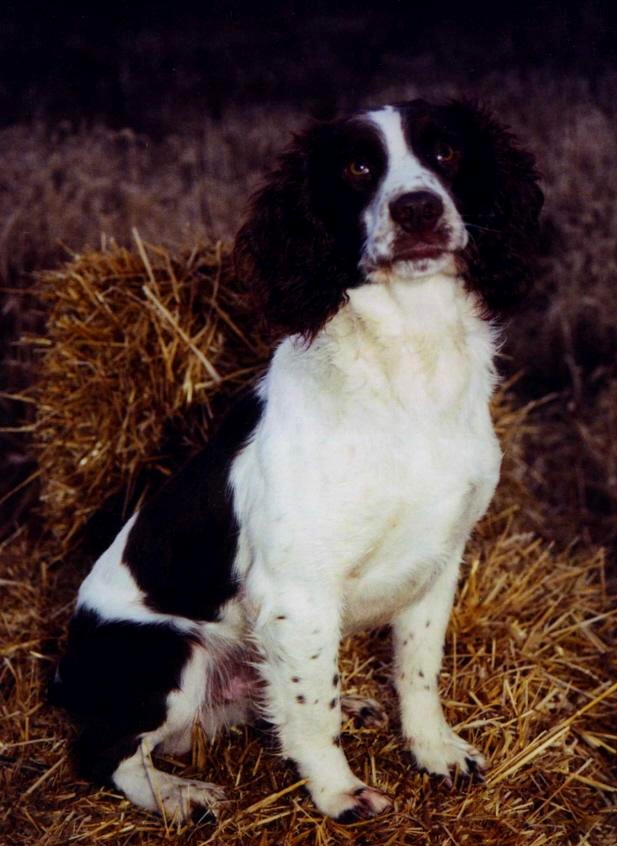
Where is `right front leg`? The height and width of the screenshot is (846, 617). right front leg is located at coordinates (296, 628).